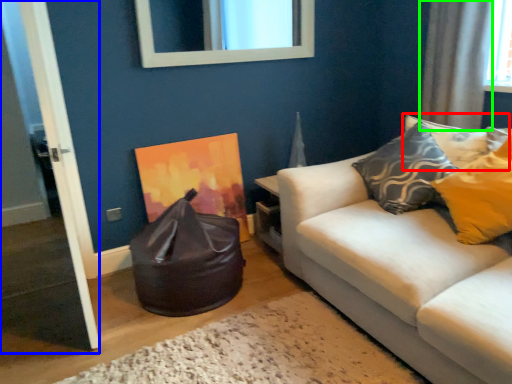
Question: Considering the real-world distances, which object is farthest from pillow (highlighted by a red box)? door (highlighted by a blue box) or curtain (highlighted by a green box)?

Choices:
 (A) door
 (B) curtain

Answer: (A)